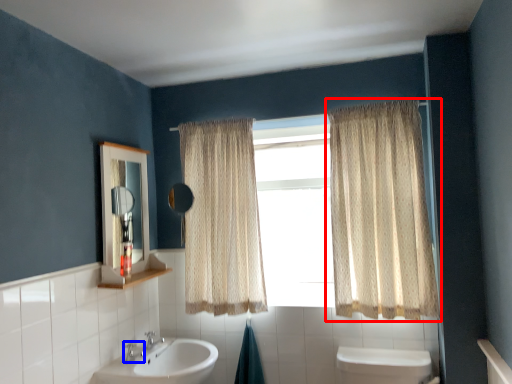
Question: Which object appears closest to the camera in this image, curtain (highlighted by a red box) or plumbing fixture (highlighted by a blue box)?

Choices:
 (A) curtain
 (B) plumbing fixture

Answer: (A)